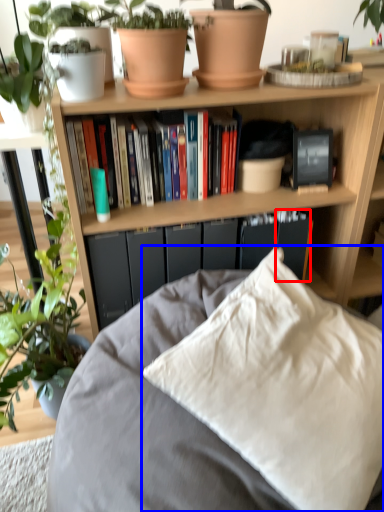
Question: Among these objects, which one is nearest to the camera, paperback book (highlighted by a red box) or pillow (highlighted by a blue box)?

Choices:
 (A) paperback book
 (B) pillow

Answer: (B)